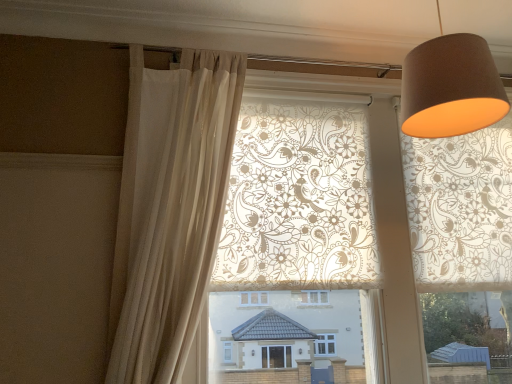
Question: Is sheer beige curtain at left taller or shorter than matte brown lampshade at upper right?

Choices:
 (A) short
 (B) tall

Answer: (B)

Question: From the image's perspective, is sheer beige curtain at left positioned above or below matte brown lampshade at upper right?

Choices:
 (A) above
 (B) below

Answer: (B)

Question: In the image, is sheer beige curtain at left on the left side or the right side of matte brown lampshade at upper right?

Choices:
 (A) left
 (B) right

Answer: (A)

Question: Is matte brown lampshade at upper right to the left or to the right of sheer beige curtain at left in the image?

Choices:
 (A) right
 (B) left

Answer: (A)

Question: In the image, is matte brown lampshade at upper right positioned in front of or behind sheer beige curtain at left?

Choices:
 (A) front
 (B) behind

Answer: (A)

Question: From a real-world perspective, is matte brown lampshade at upper right above or below sheer beige curtain at left?

Choices:
 (A) above
 (B) below

Answer: (A)

Question: Is matte brown lampshade at upper right inside or outside of sheer beige curtain at left?

Choices:
 (A) outside
 (B) inside

Answer: (A)